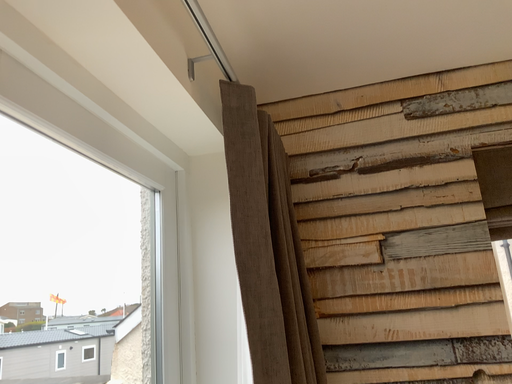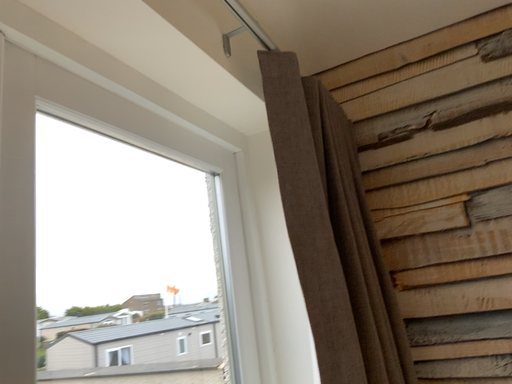
Question: Which way did the camera rotate in the video?

Choices:
 (A) rotated right
 (B) rotated left

Answer: (B)